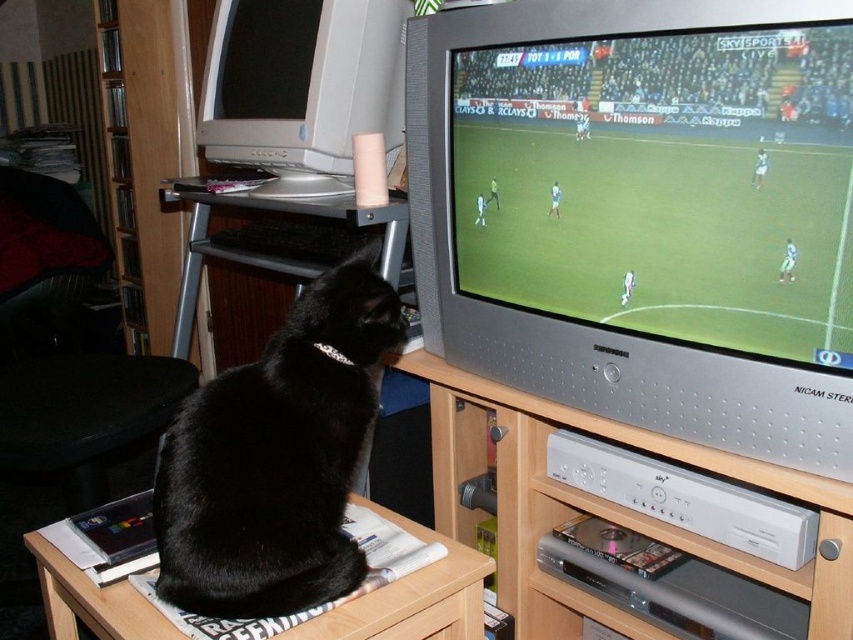
Question: Which of the following is the farthest from the observer?

Choices:
 (A) wooden entertainment center at lower center
 (B) wooden table at lower left
 (C) black fur cat at lower left

Answer: (C)

Question: Does wooden entertainment center at lower center have a larger size compared to wooden table at lower left?

Choices:
 (A) no
 (B) yes

Answer: (B)

Question: Is black fur cat at lower left positioned behind wooden table at lower left?

Choices:
 (A) no
 (B) yes

Answer: (B)

Question: Which point is closer to the camera taking this photo?

Choices:
 (A) (456, 467)
 (B) (231, 550)
 (C) (450, 566)

Answer: (B)

Question: Which point is closer to the camera?

Choices:
 (A) (347, 320)
 (B) (426, 579)
 (C) (844, 564)

Answer: (C)

Question: Is the position of wooden entertainment center at lower center less distant than that of wooden table at lower left?

Choices:
 (A) yes
 (B) no

Answer: (A)